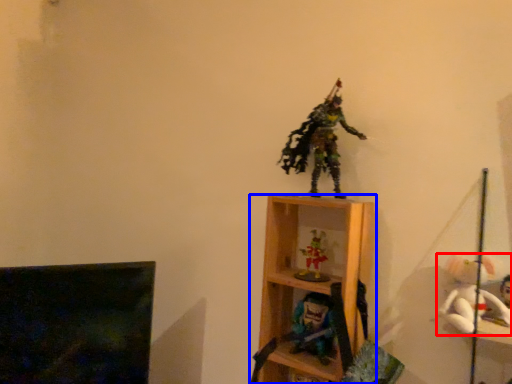
Question: Which of the following is the farthest to the observer, toy (highlighted by a red box) or shelf (highlighted by a blue box)?

Choices:
 (A) toy
 (B) shelf

Answer: (B)